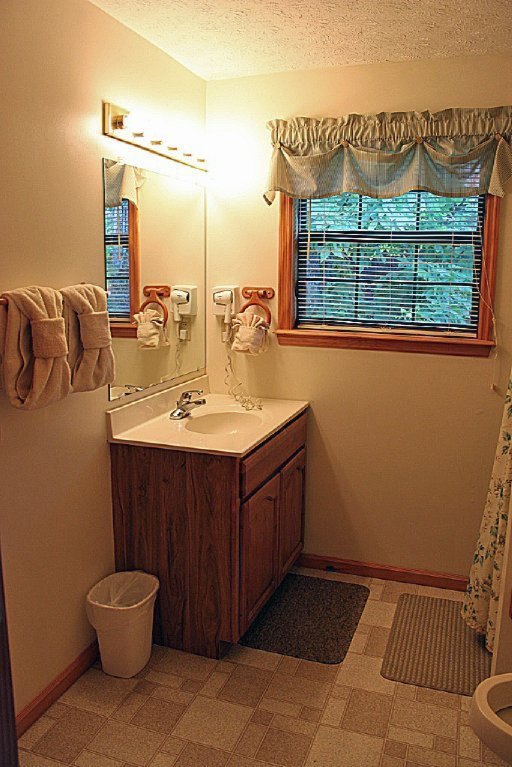
Find the location of a particular element. The width and height of the screenshot is (512, 767). mat is located at coordinates (422, 637).